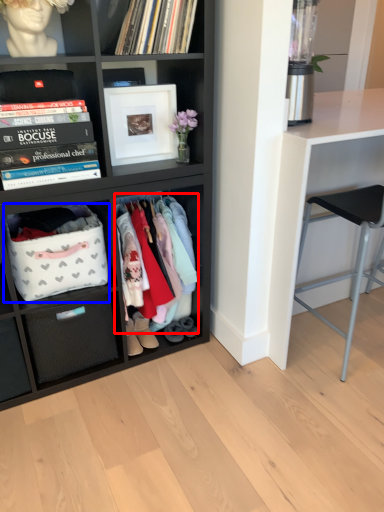
Question: Which object appears farthest to the camera in this image, clothing (highlighted by a red box) or storage box (highlighted by a blue box)?

Choices:
 (A) clothing
 (B) storage box

Answer: (A)